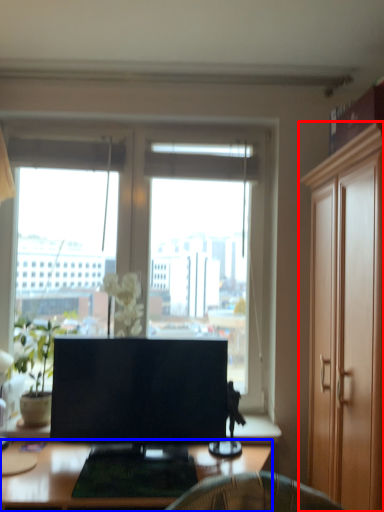
Question: Which point is closer to the camera, cabinetry (highlighted by a red box) or desk (highlighted by a blue box)?

Choices:
 (A) cabinetry
 (B) desk

Answer: (A)